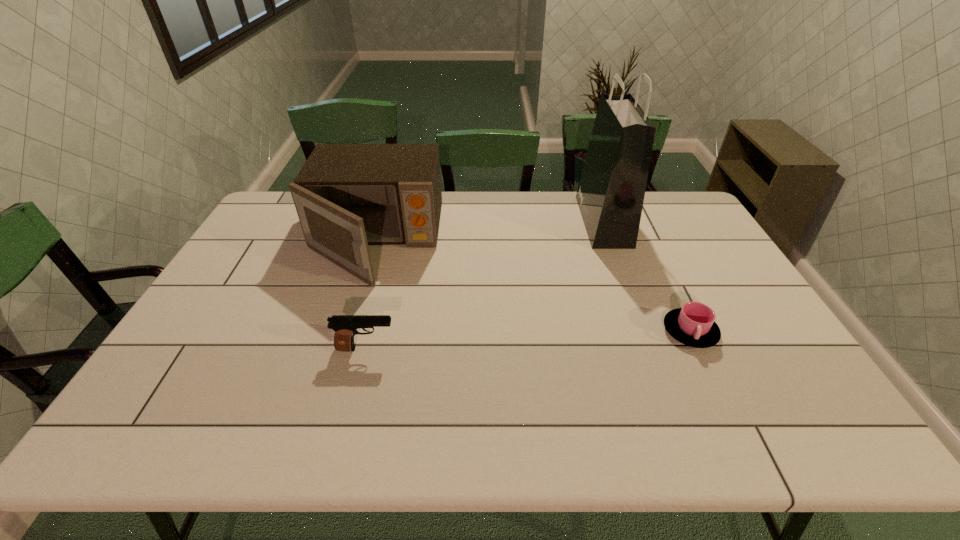
Identify the location of free space in the image that satisfies the following two spatial constraints: 1. on the front with handles of the tallest object; 2. with the door open on the front of the microwave oven. The height and width of the screenshot is (540, 960). (612, 242).

I want to click on free point that satisfies the following two spatial constraints: 1. on the side with the handle of the cup; 2. at the barrel of the pistol, so click(698, 349).

Find the location of a particular element. This screenshot has width=960, height=540. blank space that satisfies the following two spatial constraints: 1. on the front with handles of the tallest object; 2. with the door open on the front of the microwave oven is located at coordinates (612, 242).

Locate an element on the screen. vacant space that satisfies the following two spatial constraints: 1. on the front with handles of the shopping bag; 2. with the door open on the front of the microwave oven is located at coordinates (612, 242).